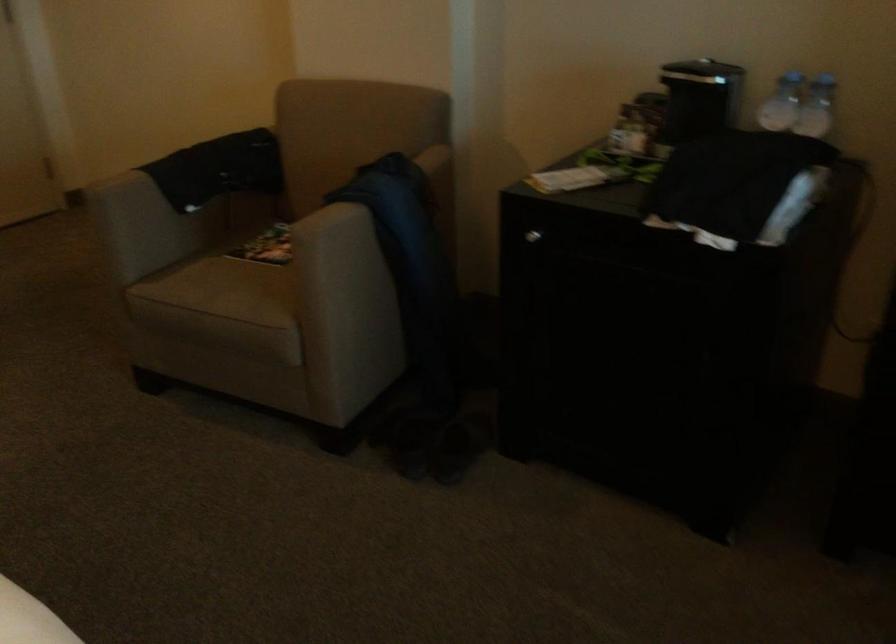
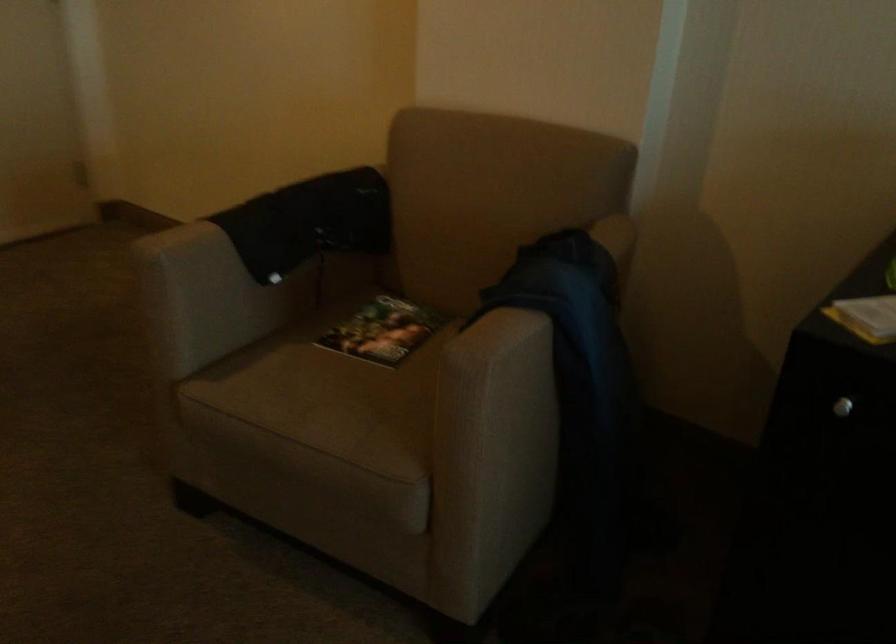
Find the pixel in the second image that matches point 273,242 in the first image.

(382, 330)